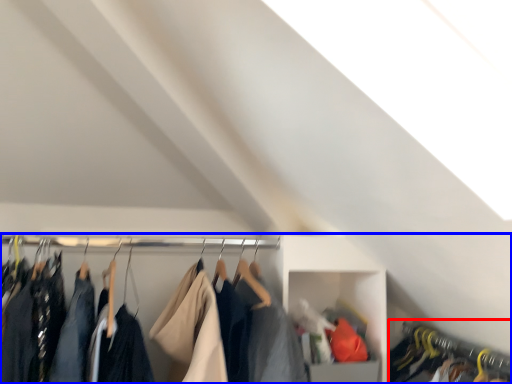
Question: Which of the following is the farthest to the observer, closet (highlighted by a red box) or closet (highlighted by a blue box)?

Choices:
 (A) closet
 (B) closet

Answer: (A)